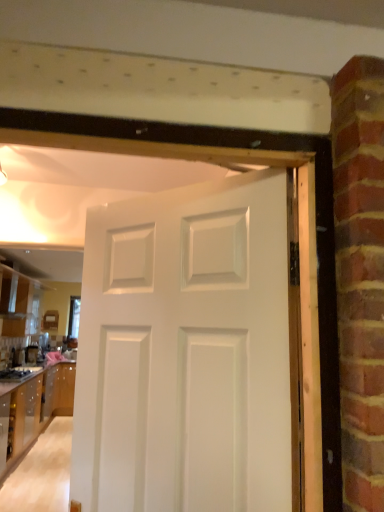
Question: Is white matte door at center inside or outside of glossy wood cabinetry at left, the 2th cabinetry ordered from the bottom?

Choices:
 (A) outside
 (B) inside

Answer: (A)

Question: From a real-world perspective, is white matte door at center positioned above or below glossy wood cabinetry at left, the 2th cabinetry ordered from the bottom?

Choices:
 (A) above
 (B) below

Answer: (B)

Question: Which object is the farthest from the glossy wood cabinetry at left, the 1th cabinetry in the top-to-bottom sequence?

Choices:
 (A) white matte door at center
 (B) satin black coffee maker at lower left
 (C) wooden cabinet at lower left, acting as the 1th cabinetry starting from the bottom

Answer: (A)

Question: Which of these objects is positioned closest to the wooden cabinet at lower left, acting as the 1th cabinetry starting from the bottom?

Choices:
 (A) glossy wood cabinetry at left, the 2th cabinetry ordered from the bottom
 (B) white matte door at center
 (C) satin black coffee maker at lower left

Answer: (C)